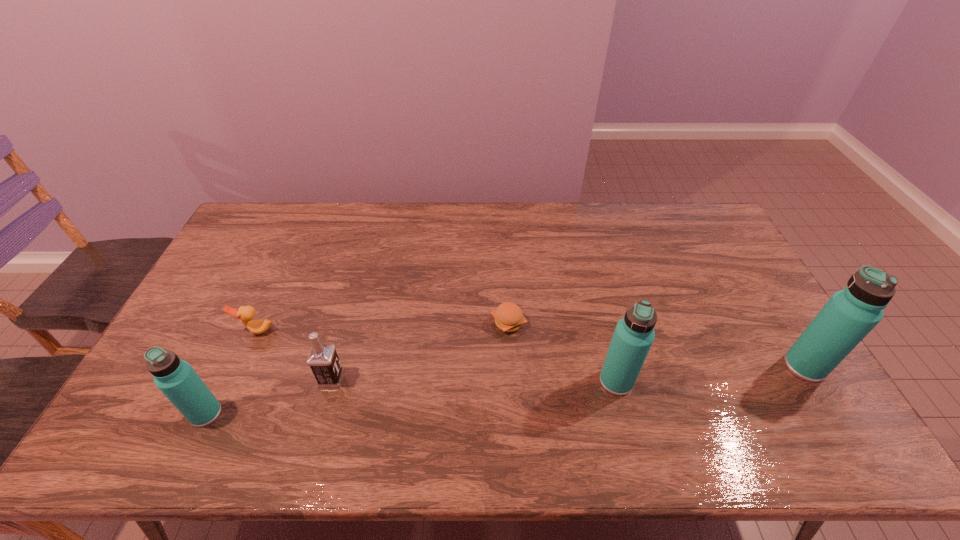
Identify the location of free space at the far edge of the desktop. (300, 222).

Where is `vacant region at the near edge of the desktop`? The image size is (960, 540). vacant region at the near edge of the desktop is located at coordinates (544, 393).

In the image, there is a desktop. What are the coordinates of `vacant space at the left edge` in the screenshot? It's located at (255, 272).

This screenshot has height=540, width=960. In order to click on vacant region at the right edge of the desktop in this screenshot , I will do `click(727, 281)`.

Find the location of `vacant space at the far left corner of the desktop`. vacant space at the far left corner of the desktop is located at coordinates (284, 205).

Find the location of a particular element. The width and height of the screenshot is (960, 540). free space between the rightmost thermos bottle and the second tallest object is located at coordinates (710, 374).

This screenshot has width=960, height=540. Identify the location of vacant area between the second thermos bottle from right to left and the third shortest object. (473, 380).

Find the location of `free space between the second shortest object and the shortest thermos bottle`. free space between the second shortest object and the shortest thermos bottle is located at coordinates (231, 372).

Find the location of a particular element. The image size is (960, 540). free space between the shortest object and the second shortest thermos bottle is located at coordinates (563, 352).

Locate an element on the screen. free space between the third object from left to right and the fourth object from left to right is located at coordinates (420, 350).